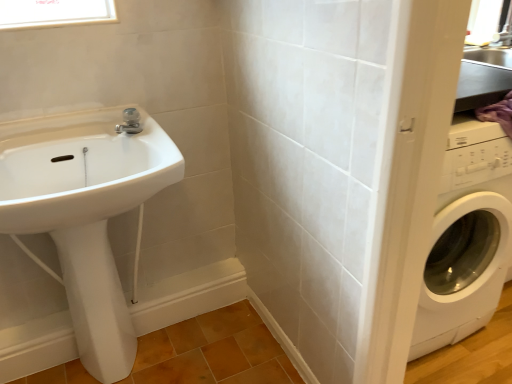
The width and height of the screenshot is (512, 384). I want to click on white glossy bidet at lower left, so click(96, 301).

Find the location of `white glossy sink at left`. white glossy sink at left is located at coordinates (80, 169).

Locate an element on the screen. white glossy bidet at lower left is located at coordinates (96, 301).

Does satin nickel faucet at upper center have a larger size compared to white glossy bidet at lower left?

No, satin nickel faucet at upper center is not bigger than white glossy bidet at lower left.

Between satin nickel faucet at upper center and white glossy bidet at lower left, which one has less height?

satin nickel faucet at upper center is shorter.

From a real-world perspective, which object stands above the other?

satin nickel faucet at upper center, from a real-world perspective.

Which is behind, point (129, 116) or point (79, 283)?

The point (129, 116) is behind.

Is clear glass window at upper left next to white glossy sink at left?

No, clear glass window at upper left is not in contact with white glossy sink at left.

From the image's perspective, does clear glass window at upper left appear lower than white glossy sink at left?

Incorrect, from the image's perspective, clear glass window at upper left is higher than white glossy sink at left.

You are a GUI agent. You are given a task and a screenshot of the screen. Output one action in this format:
    pyautogui.click(x=<x>, y=<y>)
    Task: Click on the window that is on the left side of white glossy sink at left
    The width and height of the screenshot is (512, 384).
    Given the screenshot: What is the action you would take?
    pyautogui.click(x=54, y=13)

Which object is more forward, clear glass window at upper left or white glossy sink at left?

white glossy sink at left.

Between point (55, 14) and point (128, 117), which one is positioned in front?

Positioned in front is point (55, 14).

Which is in front, clear glass window at upper left or satin nickel faucet at upper center?

clear glass window at upper left.

Is clear glass window at upper left inside the boundaries of satin nickel faucet at upper center, or outside?

clear glass window at upper left lies outside satin nickel faucet at upper center.

Visually, is clear glass window at upper left positioned to the left or to the right of satin nickel faucet at upper center?

Clearly, clear glass window at upper left is on the left of satin nickel faucet at upper center in the image.

Considering the relative sizes of white glossy sink at left and white glossy bidet at lower left in the image provided, is white glossy sink at left bigger than white glossy bidet at lower left?

Correct, white glossy sink at left is larger in size than white glossy bidet at lower left.

From a real-world perspective, is white glossy sink at left physically located above or below white glossy bidet at lower left?

white glossy sink at left is situated higher than white glossy bidet at lower left in the real world.

Is white glossy sink at left to the right of white glossy bidet at lower left from the viewer's perspective?

Yes.

Which of these two, white glossy sink at left or white glossy bidet at lower left, stands taller?

With more height is white glossy bidet at lower left.

Can you confirm if white glossy bidet at lower left is positioned to the left of white glossy sink at left?

Indeed, white glossy bidet at lower left is positioned on the left side of white glossy sink at left.

You are a GUI agent. You are given a task and a screenshot of the screen. Output one action in this format:
    pyautogui.click(x=<x>, y=<y>)
    Task: Click on the sink above the white glossy bidet at lower left (from a real-world perspective)
    
    Given the screenshot: What is the action you would take?
    pyautogui.click(x=80, y=169)

Is white glossy bidet at lower left not within white glossy sink at left?

Yes.

From a real-world perspective, which is physically below, satin nickel faucet at upper center or clear glass window at upper left?

satin nickel faucet at upper center.

Does satin nickel faucet at upper center have a greater height compared to clear glass window at upper left?

No.

Does satin nickel faucet at upper center have a smaller size compared to clear glass window at upper left?

Yes.

From the image's perspective, is satin nickel faucet at upper center over clear glass window at upper left?

No.

Is clear glass window at upper left not near white glossy bidet at lower left?

No, there isn't a large distance between clear glass window at upper left and white glossy bidet at lower left.

Based on their sizes in the image, would you say clear glass window at upper left is bigger or smaller than white glossy bidet at lower left?

Clearly, clear glass window at upper left is smaller in size than white glossy bidet at lower left.

Which is closer, (6, 15) or (117, 371)?

Point (6, 15)

At what (x,y) coordinates should I click in order to perform the action: click on tap positioned vertically above the white glossy bidet at lower left (from a real-world perspective). Please return your answer as a coordinate pair (x, y). The width and height of the screenshot is (512, 384). Looking at the image, I should click on (130, 122).

At what (x,y) coordinates should I click in order to perform the action: click on sink in front of the clear glass window at upper left. Please return your answer as a coordinate pair (x, y). The image size is (512, 384). Looking at the image, I should click on (80, 169).

Considering their positions, is white glossy sink at left positioned further to clear glass window at upper left than satin nickel faucet at upper center?

white glossy sink at left is further to clear glass window at upper left.

Considering their positions, is clear glass window at upper left positioned further to white glossy sink at left than satin nickel faucet at upper center?

clear glass window at upper left is positioned further to the anchor white glossy sink at left.

Looking at the image, which one is located closer to satin nickel faucet at upper center, white glossy bidet at lower left or white glossy sink at left?

Among the two, white glossy sink at left is located nearer to satin nickel faucet at upper center.

Considering their positions, is white glossy sink at left positioned closer to clear glass window at upper left than white glossy bidet at lower left?

white glossy sink at left is closer to clear glass window at upper left.

Considering their positions, is clear glass window at upper left positioned closer to satin nickel faucet at upper center than white glossy sink at left?

white glossy sink at left lies closer to satin nickel faucet at upper center than the other object.

From the picture: Looking at the image, which one is located closer to white glossy sink at left, satin nickel faucet at upper center or white glossy bidet at lower left?

The object closer to white glossy sink at left is satin nickel faucet at upper center.

Based on the photo, based on their spatial positions, is white glossy bidet at lower left or satin nickel faucet at upper center further from white glossy sink at left?

white glossy bidet at lower left.

Looking at the image, which one is located further to satin nickel faucet at upper center, white glossy bidet at lower left or clear glass window at upper left?

The object further to satin nickel faucet at upper center is white glossy bidet at lower left.

Where is `sink between satin nickel faucet at upper center and white glossy bidet at lower left in the vertical direction`? The image size is (512, 384). sink between satin nickel faucet at upper center and white glossy bidet at lower left in the vertical direction is located at coordinates (80, 169).

The height and width of the screenshot is (384, 512). I want to click on sink between clear glass window at upper left and white glossy bidet at lower left vertically, so pos(80,169).

Identify the location of tap between clear glass window at upper left and white glossy bidet at lower left from top to bottom. This screenshot has height=384, width=512. (130, 122).

Locate an element on the screen. tap between clear glass window at upper left and white glossy sink at left in the vertical direction is located at coordinates (130, 122).